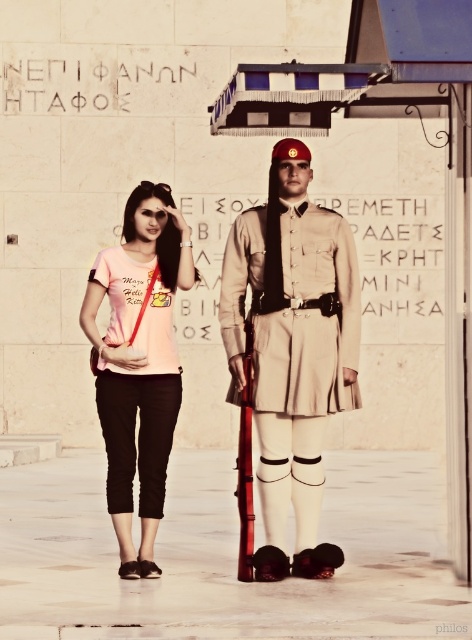
You are a photographer trying to capture both the khaki uniform at center and the light beige fabric uniform at center in a single frame. Which uniform should you focus on to ensure both are in the frame without cropping?

The khaki uniform at center is thinner than the light beige fabric uniform at center, so focusing on the khaki uniform at center would allow both to fit in the frame as it takes up less space.